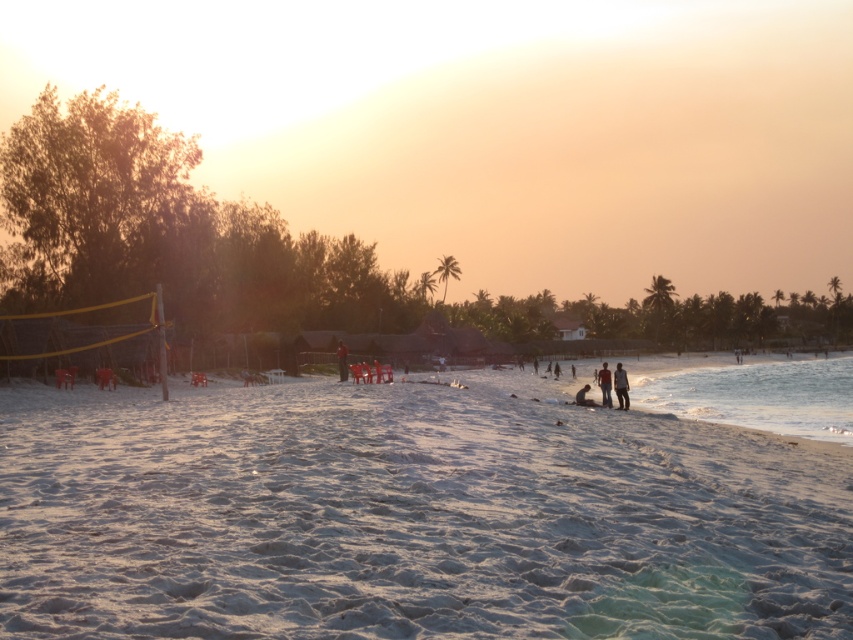
You are standing on the beach and want to pick up the light brown wooden surfboard at center and the blurred human figure at center. Which one do you need to walk towards first?

The light brown wooden surfboard at center is closer to the viewer than the blurred human figure at center, so you should pick up the light brown wooden surfboard at center first.